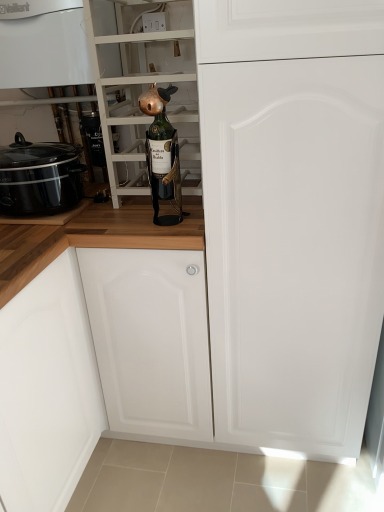
The image size is (384, 512). I want to click on unoccupied region to the right of black glossy slow cooker at left, so click(117, 219).